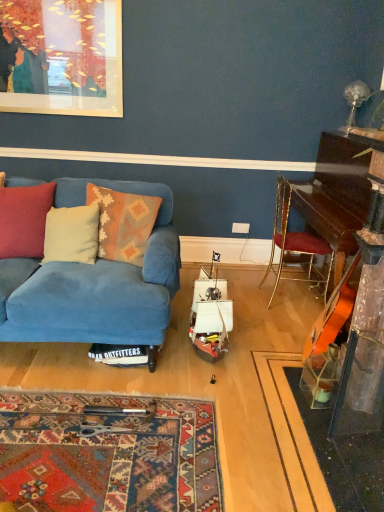
Where is `beige fabric pillow at left, which ranks as the 2th pillow in left-to-right order`? beige fabric pillow at left, which ranks as the 2th pillow in left-to-right order is located at coordinates (71, 234).

Describe the element at coordinates (352, 373) in the screenshot. I see `transparent glass guitar at right` at that location.

The width and height of the screenshot is (384, 512). What are the coordinates of `white plastic power outlet at center` in the screenshot? It's located at (240, 228).

The image size is (384, 512). Describe the element at coordinates (240, 228) in the screenshot. I see `white plastic power outlet at center` at that location.

I want to click on matte red pillow at left, acting as the 1th pillow starting from the left, so click(24, 220).

Identify the location of beige fabric pillow at left, which ranks as the 2th pillow in left-to-right order. (71, 234).

Does white plastic power outlet at center turn towards beige fabric pillow at left, which ranks as the 2th pillow in left-to-right order?

No, white plastic power outlet at center is not facing towards beige fabric pillow at left, which ranks as the 2th pillow in left-to-right order.

From the image's perspective, starting from the white plastic power outlet at center, which pillow is the 3rd one below? Please provide its 2D coordinates.

[(71, 234)]

In the scene shown: Considering the relative positions of white plastic power outlet at center and beige fabric pillow at left, which ranks as the 2th pillow in left-to-right order, in the image provided, is white plastic power outlet at center to the right of beige fabric pillow at left, which ranks as the 2th pillow in left-to-right order, from the viewer's perspective?

Yes.

Looking at this image, does transparent glass guitar at right touch knitted wool pillow at center, acting as the 3th pillow starting from the left?

No, transparent glass guitar at right is not touching knitted wool pillow at center, acting as the 3th pillow starting from the left.

Does transparent glass guitar at right turn towards knitted wool pillow at center, acting as the 3th pillow starting from the left?

Yes, transparent glass guitar at right is oriented towards knitted wool pillow at center, acting as the 3th pillow starting from the left.

Would you say transparent glass guitar at right is outside knitted wool pillow at center, which appears as the 1th pillow when viewed from the right?

That's correct, transparent glass guitar at right is outside of knitted wool pillow at center, which appears as the 1th pillow when viewed from the right.

How many degrees apart are the facing directions of transparent glass guitar at right and knitted wool pillow at center, which appears as the 1th pillow when viewed from the right?

There is a 75.2-degree angle between the facing directions of transparent glass guitar at right and knitted wool pillow at center, which appears as the 1th pillow when viewed from the right.

Considering the relative sizes of shiny dark wood piano at right and knitted wool pillow at center, acting as the 3th pillow starting from the left, in the image provided, is shiny dark wood piano at right wider than knitted wool pillow at center, acting as the 3th pillow starting from the left,?

Yes.

From a real-world perspective, which is physically below, shiny dark wood piano at right or knitted wool pillow at center, which appears as the 1th pillow when viewed from the right?

In real-world perspective, shiny dark wood piano at right is lower.

Is shiny dark wood piano at right looking in the opposite direction of knitted wool pillow at center, which appears as the 1th pillow when viewed from the right?

That's not correct — shiny dark wood piano at right is not looking away from knitted wool pillow at center, which appears as the 1th pillow when viewed from the right.

Can we say shiny dark wood piano at right lies outside knitted wool pillow at center, which appears as the 1th pillow when viewed from the right?

Indeed, shiny dark wood piano at right is completely outside knitted wool pillow at center, which appears as the 1th pillow when viewed from the right.

Which point is more distant from viewer, (381, 498) or (278, 227)?

Positioned behind is point (278, 227).

From a real-world perspective, who is located higher, transparent glass guitar at right or gold metallic chair at right?

In real-world perspective, transparent glass guitar at right is above.

Is transparent glass guitar at right closer to camera compared to gold metallic chair at right?

Yes, the depth of transparent glass guitar at right is less than that of gold metallic chair at right.

Considering the relative sizes of transparent glass guitar at right and gold metallic chair at right in the image provided, is transparent glass guitar at right thinner than gold metallic chair at right?

No.

From a real-world perspective, is knitted wool pillow at center, acting as the 3th pillow starting from the left, physically located above or below matte red pillow at left, acting as the 1th pillow starting from the left?

knitted wool pillow at center, acting as the 3th pillow starting from the left, is above matte red pillow at left, acting as the 1th pillow starting from the left.

Does knitted wool pillow at center, acting as the 3th pillow starting from the left, appear on the left side of matte red pillow at left, arranged as the 3th pillow when viewed from the right?

In fact, knitted wool pillow at center, acting as the 3th pillow starting from the left, is to the right of matte red pillow at left, arranged as the 3th pillow when viewed from the right.

Looking at this image, from the image's perspective, is knitted wool pillow at center, which appears as the 1th pillow when viewed from the right, located above matte red pillow at left, acting as the 1th pillow starting from the left?

Actually, knitted wool pillow at center, which appears as the 1th pillow when viewed from the right, appears below matte red pillow at left, acting as the 1th pillow starting from the left, in the image.

Is knitted wool pillow at center, acting as the 3th pillow starting from the left, not near beige fabric pillow at left, which is the second pillow in right-to-left order?

That's not correct — knitted wool pillow at center, acting as the 3th pillow starting from the left, is a little close to beige fabric pillow at left, which is the second pillow in right-to-left order.

Considering the relative sizes of knitted wool pillow at center, which appears as the 1th pillow when viewed from the right, and beige fabric pillow at left, which is the second pillow in right-to-left order, in the image provided, is knitted wool pillow at center, which appears as the 1th pillow when viewed from the right, shorter than beige fabric pillow at left, which is the second pillow in right-to-left order,?

No.

From the image's perspective, is knitted wool pillow at center, which appears as the 1th pillow when viewed from the right, on top of beige fabric pillow at left, which ranks as the 2th pillow in left-to-right order?

Correct, knitted wool pillow at center, which appears as the 1th pillow when viewed from the right, appears higher than beige fabric pillow at left, which ranks as the 2th pillow in left-to-right order, in the image.

Could you tell me if knitted wool pillow at center, which appears as the 1th pillow when viewed from the right, is facing beige fabric pillow at left, which is the second pillow in right-to-left order?

No, knitted wool pillow at center, which appears as the 1th pillow when viewed from the right, is not aimed at beige fabric pillow at left, which is the second pillow in right-to-left order.

From the picture: Does gold metallic chair at right have a lesser height compared to beige fabric pillow at left, which is the second pillow in right-to-left order?

No, gold metallic chair at right is not shorter than beige fabric pillow at left, which is the second pillow in right-to-left order.

Are gold metallic chair at right and beige fabric pillow at left, which is the second pillow in right-to-left order, located far from each other?

Yes, gold metallic chair at right and beige fabric pillow at left, which is the second pillow in right-to-left order, are located far from each other.

In the image, is gold metallic chair at right positioned in front of or behind beige fabric pillow at left, which is the second pillow in right-to-left order?

gold metallic chair at right is positioned farther from the viewer than beige fabric pillow at left, which is the second pillow in right-to-left order.

Where is `chair below the beige fabric pillow at left, which ranks as the 2th pillow in left-to-right order (from a real-world perspective)`? This screenshot has width=384, height=512. chair below the beige fabric pillow at left, which ranks as the 2th pillow in left-to-right order (from a real-world perspective) is located at coordinates (295, 245).

From the image's perspective, count 3rd pillows downward from the white plastic power outlet at center and point to it. Please provide its 2D coordinates.

[(71, 234)]

Starting from the transparent glass guitar at right, which pillow is the 2nd one behind? Please provide its 2D coordinates.

[(123, 223)]

Considering their positions, is white plastic power outlet at center positioned further to gold metallic chair at right than transparent glass guitar at right?

Based on the image, transparent glass guitar at right appears to be further to gold metallic chair at right.

Consider the image. Considering their positions, is white plastic power outlet at center positioned further to transparent glass guitar at right than knitted wool pillow at center, which appears as the 1th pillow when viewed from the right?

Based on the image, white plastic power outlet at center appears to be further to transparent glass guitar at right.

Based on their spatial positions, is beige fabric pillow at left, which ranks as the 2th pillow in left-to-right order, or shiny dark wood piano at right closer to knitted wool pillow at center, which appears as the 1th pillow when viewed from the right?

beige fabric pillow at left, which ranks as the 2th pillow in left-to-right order.

From the picture: Estimate the real-world distances between objects in this image. Which object is further from blue fabric couch at left, knitted wool pillow at center, acting as the 3th pillow starting from the left, or shiny dark wood piano at right?

shiny dark wood piano at right lies further to blue fabric couch at left than the other object.

In the scene shown: From the image, which object appears to be farther from knitted wool pillow at center, which appears as the 1th pillow when viewed from the right, white plastic power outlet at center or gold metallic chair at right?

white plastic power outlet at center is positioned further to the anchor knitted wool pillow at center, which appears as the 1th pillow when viewed from the right.

Looking at the image, which one is located further to white plastic power outlet at center, shiny dark wood piano at right or transparent glass guitar at right?

transparent glass guitar at right.

Which object lies further to the anchor point knitted wool pillow at center, acting as the 3th pillow starting from the left, gold metallic chair at right or white plastic power outlet at center?

Among the two, white plastic power outlet at center is located further to knitted wool pillow at center, acting as the 3th pillow starting from the left.

Based on their spatial positions, is blue fabric couch at left or gold metallic chair at right closer to transparent glass guitar at right?

gold metallic chair at right is positioned closer to the anchor transparent glass guitar at right.

The width and height of the screenshot is (384, 512). Identify the location of desk situated between blue fabric couch at left and shiny dark wood piano at right from left to right. (352, 373).

Find the location of a particular element. The image size is (384, 512). chair between matte red pillow at left, arranged as the 3th pillow when viewed from the right, and shiny dark wood piano at right is located at coordinates (295, 245).

At what (x,y) coordinates should I click in order to perform the action: click on pillow between blue fabric couch at left and knitted wool pillow at center, acting as the 3th pillow starting from the left, along the z-axis. Please return your answer as a coordinate pair (x, y). Looking at the image, I should click on pos(24,220).

Where is `pillow between beige fabric pillow at left, which is the second pillow in right-to-left order, and gold metallic chair at right, in the horizontal direction`? pillow between beige fabric pillow at left, which is the second pillow in right-to-left order, and gold metallic chair at right, in the horizontal direction is located at coordinates (123, 223).